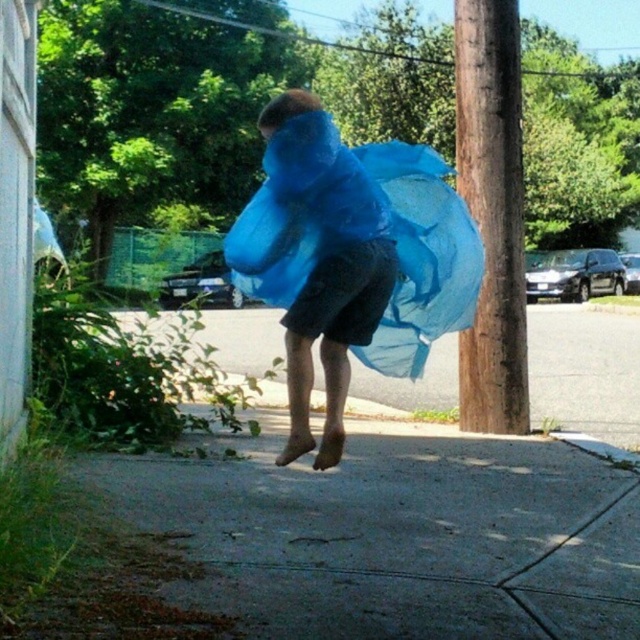
You are a delivery drone that needs to land on the gray concrete pavement at lower center. However, there is a blue sheer fabric at center in the way. Based on their heights, can you safely land on the pavement without the fabric obstructing your path?

The gray concrete pavement at lower center is not as tall as the blue sheer fabric at center, meaning the pavement is lower. Since the fabric is taller, it might hang over the pavement. Therefore, the drone should adjust its landing path to avoid the fabric obstruction.

You are a delivery drone trying to land on the gray concrete pavement at lower center. The landing coordinates must be within a 0.1 meter radius of the exact center point of the pavement. Given that the pavement is at point 0.836, 0.622, can you safely land within the required radius?

The gray concrete pavement at lower center is located at point (x=397, y=534). Since the landing coordinates must be within a 0.1 meter radius of the exact center, the drone can safely land there as long as it targets the center point precisely.